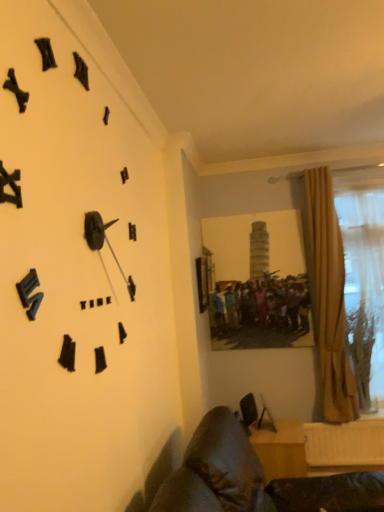
Question: Considering the positions of leather couch at lower left, which is the second furniture in back-to-front order, and beige fabric curtain at right in the image, is leather couch at lower left, which is the second furniture in back-to-front order, wider or thinner than beige fabric curtain at right?

Choices:
 (A) wide
 (B) thin

Answer: (A)

Question: From their relative heights in the image, would you say leather couch at lower left, which is the first furniture from front to back, is taller or shorter than beige fabric curtain at right?

Choices:
 (A) short
 (B) tall

Answer: (A)

Question: Which object is positioned farthest from the beige fabric curtain at right?

Choices:
 (A) black matte clock at upper left
 (B) translucent fabric curtain at right
 (C) leather couch at lower left, which is the first furniture from front to back
 (D) wooden desk at lower right, arranged as the 1th furniture when viewed from the back

Answer: (A)

Question: Considering the real-world distances, which object is farthest from the black matte clock at upper left?

Choices:
 (A) translucent fabric curtain at right
 (B) beige fabric curtain at right
 (C) wooden desk at lower right, arranged as the 1th furniture when viewed from the back
 (D) leather couch at lower left, which is the first furniture from front to back

Answer: (A)